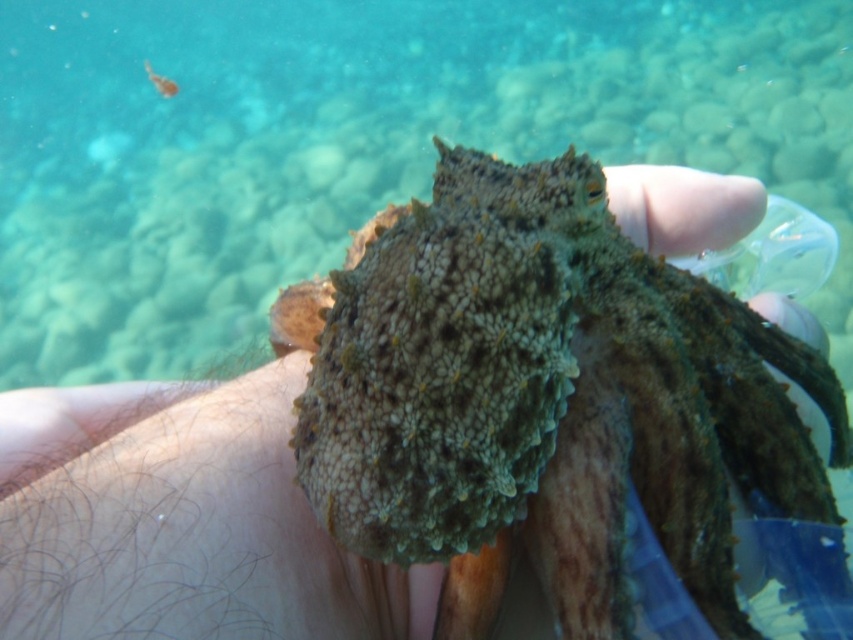
In the scene shown: You are a marine biologist examining an underwater image. You notice two points labeled as point coordinates in the scene. Which point, point (166, 582) or point (158, 76), is nearer to the camera?

Point (166, 582) is closer to the camera than point (158, 76).

You are a marine biologist examining an underwater scene. You notice the camouflage textured octopus at center and the hairless skin at lower center. Which object is positioned to the right of the other?

The camouflage textured octopus at center is to the right of the hairless skin at lower center.